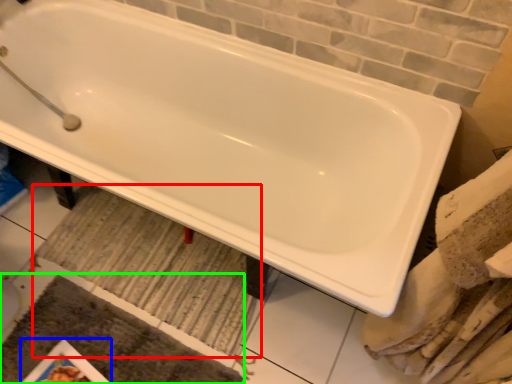
Question: Which is nearer to the bath mat (highlighted by a red box)? magazine (highlighted by a blue box) or bath mat (highlighted by a green box).

Choices:
 (A) magazine
 (B) bath mat

Answer: (B)